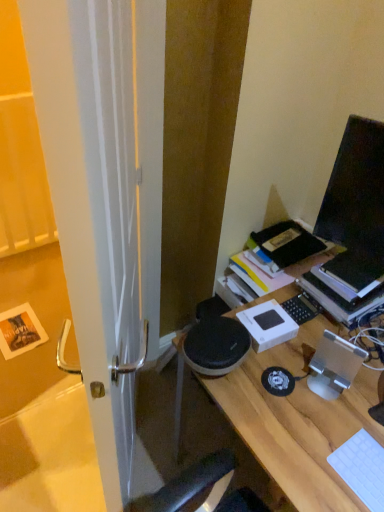
Question: Is hardcover book at upper right shorter than white glossy door at left?

Choices:
 (A) yes
 (B) no

Answer: (A)

Question: Can you confirm if hardcover book at upper right is taller than white glossy door at left?

Choices:
 (A) yes
 (B) no

Answer: (B)

Question: Does hardcover book at upper right contain white glossy door at left?

Choices:
 (A) no
 (B) yes

Answer: (A)

Question: Is hardcover book at upper right looking in the opposite direction of white glossy door at left?

Choices:
 (A) no
 (B) yes

Answer: (A)

Question: Is hardcover book at upper right further to camera compared to white glossy door at left?

Choices:
 (A) no
 (B) yes

Answer: (B)

Question: Are hardcover book at upper right and white glossy door at left located far from each other?

Choices:
 (A) yes
 (B) no

Answer: (B)

Question: Is hardcover book at upper right completely or partially outside of wooden desk at center?

Choices:
 (A) no
 (B) yes

Answer: (B)

Question: From a real-world perspective, is hardcover book at upper right positioned over wooden desk at center based on gravity?

Choices:
 (A) no
 (B) yes

Answer: (B)

Question: Is hardcover book at upper right behind wooden desk at center?

Choices:
 (A) no
 (B) yes

Answer: (B)

Question: Does hardcover book at upper right appear on the right side of wooden desk at center?

Choices:
 (A) yes
 (B) no

Answer: (A)

Question: Does hardcover book at upper right have a smaller size compared to wooden desk at center?

Choices:
 (A) no
 (B) yes

Answer: (B)

Question: From a real-world perspective, is hardcover book at upper right under wooden desk at center?

Choices:
 (A) yes
 (B) no

Answer: (B)

Question: Can you confirm if white plastic keyboard at lower right is smaller than wooden desk at center?

Choices:
 (A) no
 (B) yes

Answer: (B)